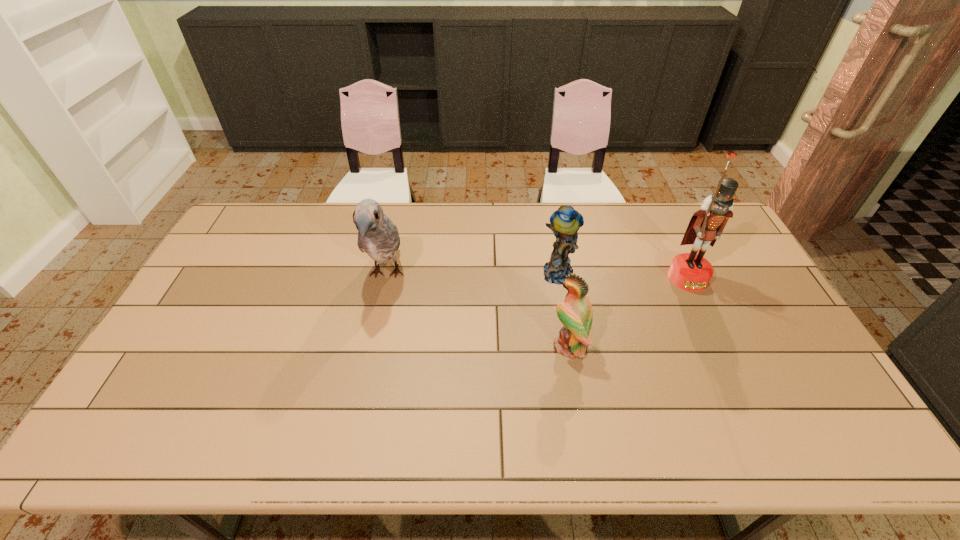
You are a GUI agent. You are given a task and a screenshot of the screen. Output one action in this format:
    pyautogui.click(x=<x>, y=<y>)
    Task: Click on the object that is at the right edge
    
    Given the screenshot: What is the action you would take?
    pyautogui.click(x=692, y=272)

Identify the location of vacant space at the far edge. (470, 213).

This screenshot has height=540, width=960. Find the location of `vacant position at the near edge of the desktop`. vacant position at the near edge of the desktop is located at coordinates (193, 441).

The image size is (960, 540). I want to click on vacant space at the left edge, so click(x=248, y=286).

This screenshot has width=960, height=540. In the image, there is a desktop. In order to click on vacant space at the right edge in this screenshot , I will do `click(729, 250)`.

This screenshot has width=960, height=540. I want to click on blank space at the far left corner, so click(x=246, y=208).

In order to click on empty space that is in between the leftmost object and the nearest object in this screenshot , I will do `click(478, 310)`.

Identify the location of free space between the tallest object and the nearest parrot. 629,312.

The image size is (960, 540). Find the location of `object that ranks as the third closest to the leftmost parrot`. object that ranks as the third closest to the leftmost parrot is located at coordinates (692, 272).

Locate an element on the screen. This screenshot has height=540, width=960. object that is the third closest to the leftmost object is located at coordinates (692, 272).